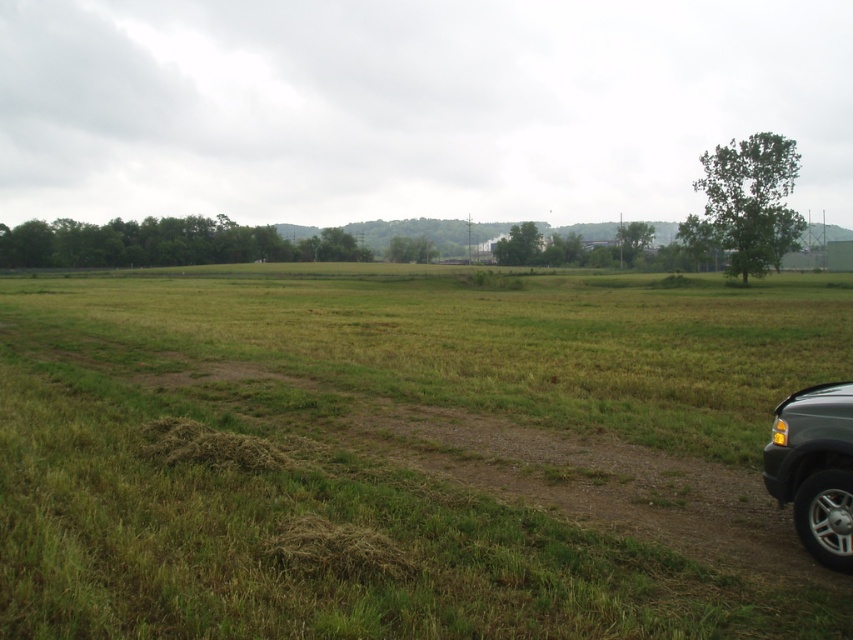
You are standing at the edge of the image and want to walk towards the green grassy field at center. Based on its coordinates, in which general direction should you head?

The green grassy field at center is located at coordinates point (x=409, y=454), which means it is positioned towards the upper right of the image. Therefore, you should head in the upper right direction to reach it.